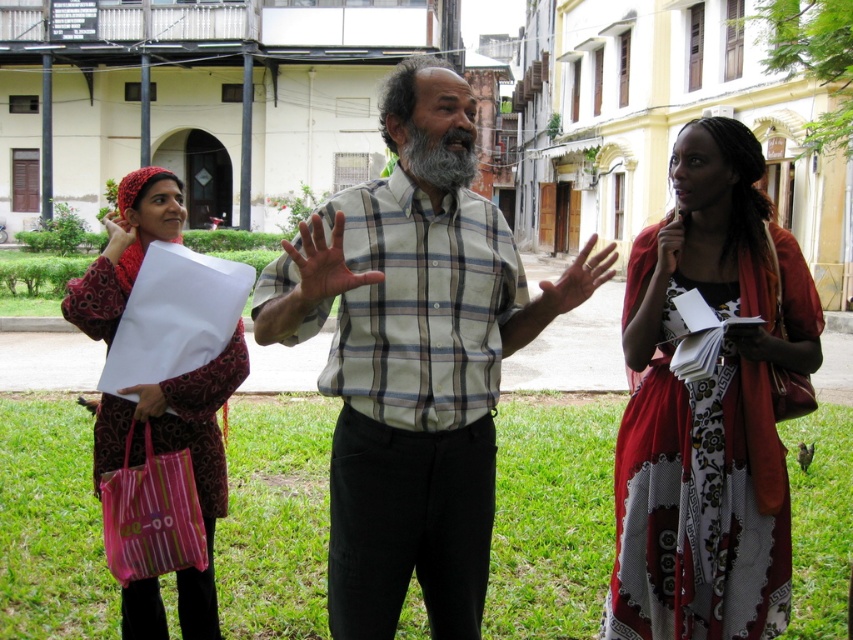
Is light beige plaid shirt at center bigger than pink striped fabric shopping bag at lower left?

Yes, light beige plaid shirt at center is bigger than pink striped fabric shopping bag at lower left.

Based on the photo, how distant is light beige plaid shirt at center from pink striped fabric shopping bag at lower left?

They are 27.27 inches apart.

From the picture: Measure the distance between light beige plaid shirt at center and camera.

light beige plaid shirt at center is 7.38 feet away from camera.

Identify the location of light beige plaid shirt at center. (413, 356).

Who is more forward, (486, 461) or (682, 243)?

Point (486, 461)

Which is below, light beige plaid shirt at center or floral cotton dress at center?

floral cotton dress at center is lower down.

Identify the location of light beige plaid shirt at center. (413, 356).

Locate an element on the screen. The image size is (853, 640). light beige plaid shirt at center is located at coordinates (413, 356).

Between point (467, 394) and point (117, 412), which one is positioned behind?

Positioned behind is point (117, 412).

Does point (373, 385) come in front of point (212, 449)?

Yes, point (373, 385) is closer to viewer.

The width and height of the screenshot is (853, 640). In order to click on light beige plaid shirt at center in this screenshot , I will do `click(413, 356)`.